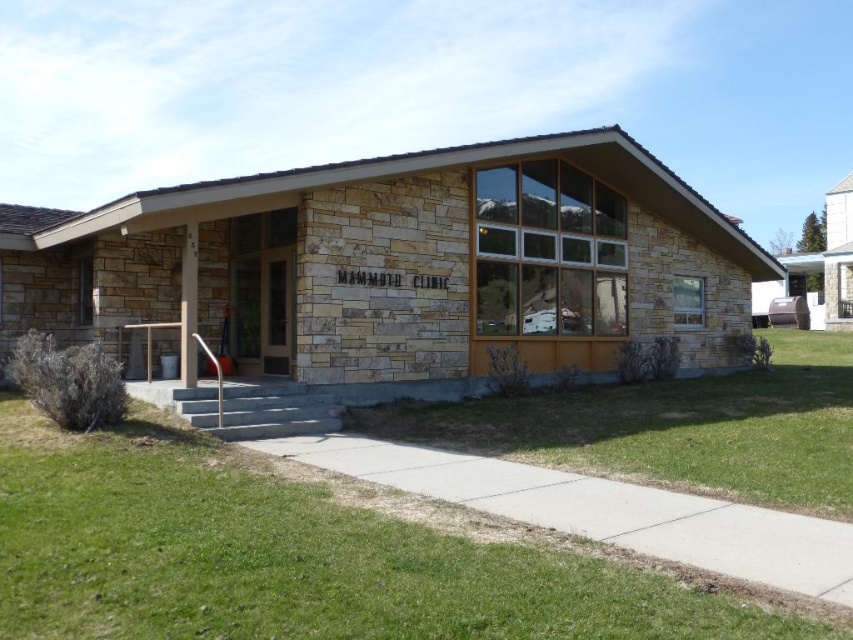
Question: Is the position of green grass at lower left less distant than that of green grass at lower center?

Choices:
 (A) no
 (B) yes

Answer: (B)

Question: Is green grass at lower left smaller than green grass at lower center?

Choices:
 (A) yes
 (B) no

Answer: (A)

Question: Is green grass at lower left positioned at the back of green grass at lower center?

Choices:
 (A) no
 (B) yes

Answer: (A)